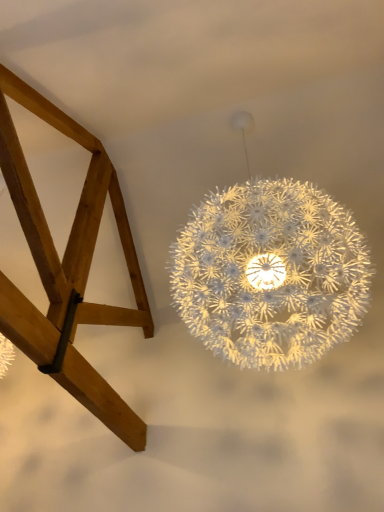
Describe the element at coordinates (270, 271) in the screenshot. I see `white matte spherical lamp at center` at that location.

What are the coordinates of `white matte spherical lamp at center` in the screenshot? It's located at (270, 271).

Measure the distance between point (14, 94) and camera.

Point (14, 94) is 7.60 feet from camera.

The height and width of the screenshot is (512, 384). Describe the element at coordinates (67, 265) in the screenshot. I see `light brown wood frame at lower left` at that location.

Identify the location of light brown wood frame at lower left. The image size is (384, 512). (67, 265).

Locate an element on the screen. white matte spherical lamp at center is located at coordinates (270, 271).

Based on their positions, is white matte spherical lamp at center located to the left or right of light brown wood frame at lower left?

Clearly, white matte spherical lamp at center is on the right of light brown wood frame at lower left in the image.

Who is more distant, white matte spherical lamp at center or light brown wood frame at lower left?

white matte spherical lamp at center is more distant.

Which is behind, point (329, 346) or point (80, 130)?

Point (80, 130)

Consider the image. From the image's perspective, is white matte spherical lamp at center below light brown wood frame at lower left?

No, from the image's perspective, white matte spherical lamp at center is not beneath light brown wood frame at lower left.

From a real-world perspective, is white matte spherical lamp at center beneath light brown wood frame at lower left?

Yes.

Is white matte spherical lamp at center thinner than light brown wood frame at lower left?

Correct, the width of white matte spherical lamp at center is less than that of light brown wood frame at lower left.

Can you confirm if white matte spherical lamp at center is taller than light brown wood frame at lower left?

Indeed, white matte spherical lamp at center has a greater height compared to light brown wood frame at lower left.

Which of these two, white matte spherical lamp at center or light brown wood frame at lower left, is bigger?

white matte spherical lamp at center is bigger.

Would you say white matte spherical lamp at center is outside light brown wood frame at lower left?

Absolutely, white matte spherical lamp at center is external to light brown wood frame at lower left.

Are white matte spherical lamp at center and light brown wood frame at lower left located far from each other?

white matte spherical lamp at center is positioned a significant distance from light brown wood frame at lower left.

Is white matte spherical lamp at center facing towards light brown wood frame at lower left?

→ No, white matte spherical lamp at center is not turned towards light brown wood frame at lower left.

Can you tell me how much white matte spherical lamp at center and light brown wood frame at lower left differ in facing direction?

They differ by 180 degrees in their facing directions.

Where is `lamp below the light brown wood frame at lower left (from a real-world perspective)`? lamp below the light brown wood frame at lower left (from a real-world perspective) is located at coordinates (270, 271).

Would you say light brown wood frame at lower left is to the left or to the right of white matte spherical lamp at center in the picture?

From the image, it's evident that light brown wood frame at lower left is to the left of white matte spherical lamp at center.

Which object is closer to the camera, light brown wood frame at lower left or white matte spherical lamp at center?

light brown wood frame at lower left is in front.

Does point (73, 263) lie behind point (352, 248)?

Yes, point (73, 263) is behind point (352, 248).

From the image's perspective, is light brown wood frame at lower left beneath white matte spherical lamp at center?

Indeed, from the image's perspective, light brown wood frame at lower left is shown beneath white matte spherical lamp at center.

From a real-world perspective, which is physically below, light brown wood frame at lower left or white matte spherical lamp at center?

From a 3D spatial view, white matte spherical lamp at center is below.

From the picture: Does light brown wood frame at lower left have a lesser width compared to white matte spherical lamp at center?

No, light brown wood frame at lower left is not thinner than white matte spherical lamp at center.

Is light brown wood frame at lower left taller or shorter than white matte spherical lamp at center?

light brown wood frame at lower left is shorter than white matte spherical lamp at center.

Is light brown wood frame at lower left bigger than white matte spherical lamp at center?

Actually, light brown wood frame at lower left might be smaller than white matte spherical lamp at center.

Is light brown wood frame at lower left inside the boundaries of white matte spherical lamp at center, or outside?

light brown wood frame at lower left is not inside white matte spherical lamp at center, it's outside.

Is light brown wood frame at lower left not close to white matte spherical lamp at center?

light brown wood frame at lower left is far away from white matte spherical lamp at center.

Is light brown wood frame at lower left oriented away from white matte spherical lamp at center?

No, light brown wood frame at lower left is not facing away from white matte spherical lamp at center.

You are a GUI agent. You are given a task and a screenshot of the screen. Output one action in this format:
    pyautogui.click(x=<x>, y=<y>)
    Task: Click on the furniture below the white matte spherical lamp at center (from the image's perspective)
    The width and height of the screenshot is (384, 512).
    Given the screenshot: What is the action you would take?
    pyautogui.click(x=67, y=265)

Find the location of a particular element. This screenshot has height=512, width=384. lamp lying behind the light brown wood frame at lower left is located at coordinates (270, 271).

The width and height of the screenshot is (384, 512). What are the coordinates of `furniture below the white matte spherical lamp at center (from the image's perspective)` in the screenshot? It's located at (67, 265).